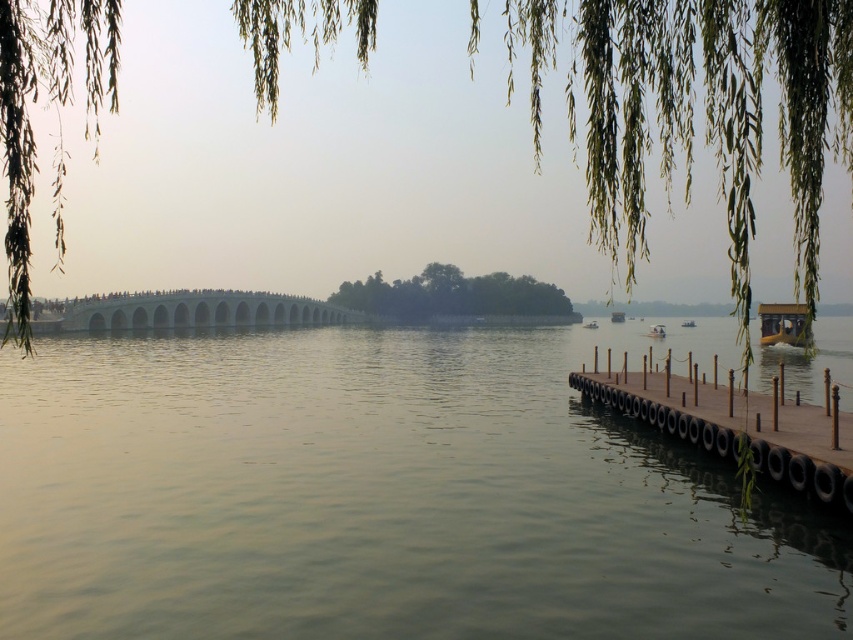
Question: Among these points, which one is nearest to the camera?

Choices:
 (A) (622, 412)
 (B) (614, 321)

Answer: (A)

Question: Which object is closer to the camera taking this photo?

Choices:
 (A) brown wooden dock at lower right
 (B) green leafy island at center
 (C) greenish water at center
 (D) wooden boat at center

Answer: (A)

Question: Which point is farther to the camera?

Choices:
 (A) (688, 320)
 (B) (619, 316)
 (C) (523, 280)

Answer: (B)

Question: Can you confirm if white plastic boat at lower center is positioned above white plastic boat at lower right?

Choices:
 (A) yes
 (B) no

Answer: (B)

Question: Is brown wooden dock at lower right positioned at the back of wooden boat at center?

Choices:
 (A) no
 (B) yes

Answer: (A)

Question: Can you confirm if green leafy willow at upper left is positioned to the left of wooden boat at center?

Choices:
 (A) yes
 (B) no

Answer: (A)